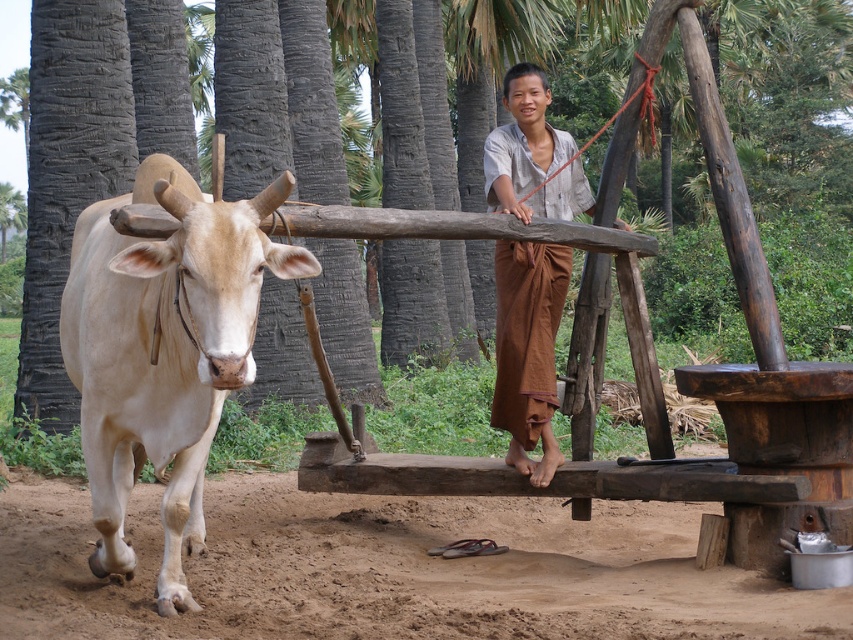
Question: Does brown dirt field at lower center appear over light beige horned bull at left?

Choices:
 (A) no
 (B) yes

Answer: (A)

Question: Which object is positioned farthest from the brown cotton skirt at center?

Choices:
 (A) light beige horned bull at left
 (B) brown dirt field at lower center

Answer: (A)

Question: Among these points, which one is farthest from the camera?

Choices:
 (A) (178, 342)
 (B) (508, 182)
 (C) (279, 579)

Answer: (B)

Question: Where is light beige horned bull at left located in relation to brown cotton skirt at center in the image?

Choices:
 (A) right
 (B) left

Answer: (B)

Question: Can you confirm if brown dirt field at lower center is positioned to the right of light beige horned bull at left?

Choices:
 (A) yes
 (B) no

Answer: (A)

Question: Which point is farther to the camera?

Choices:
 (A) (161, 624)
 (B) (164, 188)

Answer: (A)